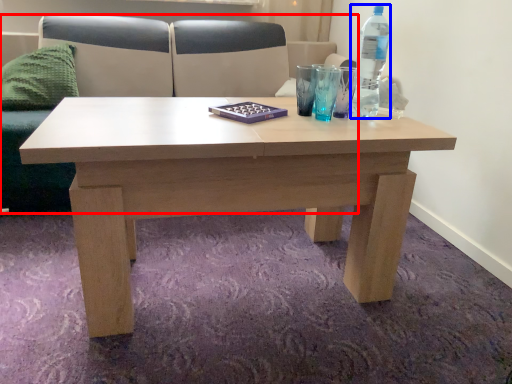
Question: Which object appears closest to the camera in this image, couch (highlighted by a red box) or bottle (highlighted by a blue box)?

Choices:
 (A) couch
 (B) bottle

Answer: (B)